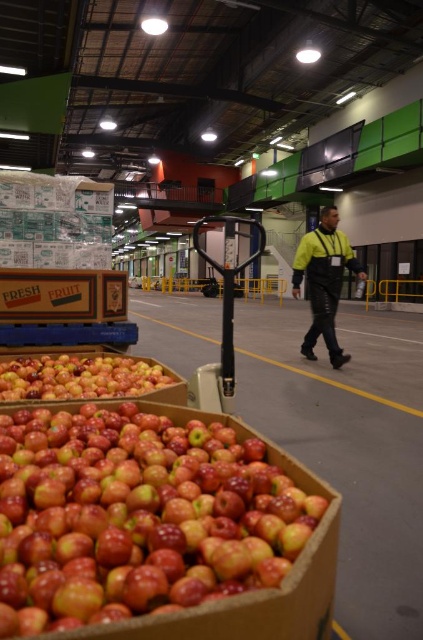
The width and height of the screenshot is (423, 640). What do you see at coordinates (158, 528) in the screenshot? I see `shiny red apples at lower left` at bounding box center [158, 528].

Which is below, shiny red apples at lower left or glossy red apples at center?

Positioned lower is shiny red apples at lower left.

Where is `shiny red apples at lower left`? shiny red apples at lower left is located at coordinates (158, 528).

Where is `shiny red apples at lower left`? The width and height of the screenshot is (423, 640). shiny red apples at lower left is located at coordinates (158, 528).

Based on the photo, is glossy red apples at center bigger than yellow reflective jacket at center?

Correct, glossy red apples at center is larger in size than yellow reflective jacket at center.

Is glossy red apples at center to the left of yellow reflective jacket at center from the viewer's perspective?

Correct, you'll find glossy red apples at center to the left of yellow reflective jacket at center.

Is point (49, 388) closer to viewer compared to point (302, 275)?

Yes.

You are a GUI agent. You are given a task and a screenshot of the screen. Output one action in this format:
    pyautogui.click(x=<x>, y=<y>)
    Task: Click on the glossy red apples at center
    
    Given the screenshot: What is the action you would take?
    pyautogui.click(x=80, y=376)

Between shiny red apples at lower left and yellow reflective jacket at center, which one is positioned higher?

yellow reflective jacket at center

Identify the location of shiny red apples at lower left. Image resolution: width=423 pixels, height=640 pixels. (158, 528).